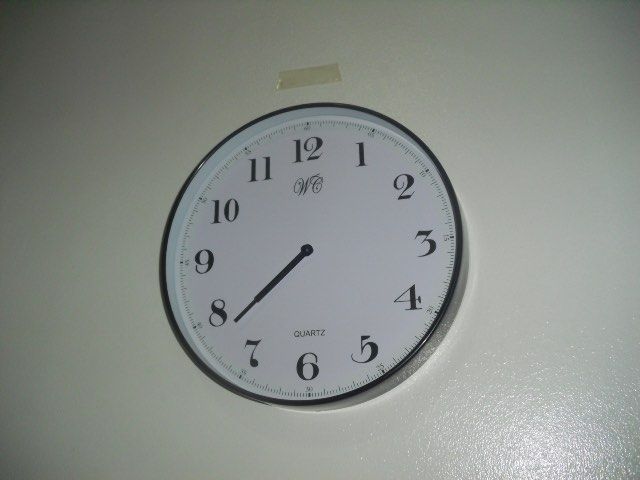
Identify the location of wall. The width and height of the screenshot is (640, 480). (541, 154).